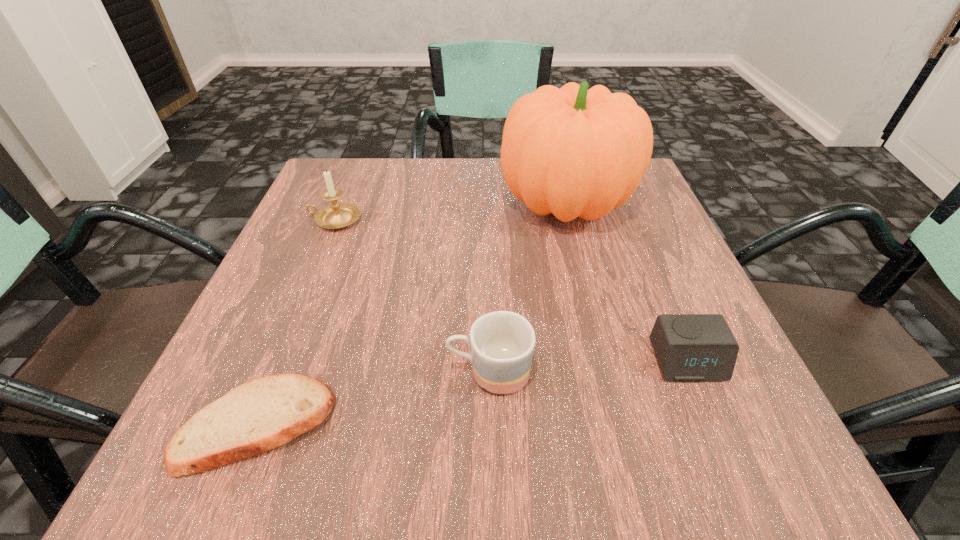
Identify the location of pumpkin. (573, 152).

Locate an element on the screen. The width and height of the screenshot is (960, 540). the second tallest object is located at coordinates (336, 215).

Where is `the third shortest object`? The image size is (960, 540). the third shortest object is located at coordinates (502, 343).

This screenshot has width=960, height=540. What are the coordinates of `the second shortest object` in the screenshot? It's located at (689, 347).

You are a GUI agent. You are given a task and a screenshot of the screen. Output one action in this format:
    pyautogui.click(x=<x>, y=<y>)
    Task: Click on the pita bread
    This screenshot has width=960, height=540.
    Given the screenshot: What is the action you would take?
    pyautogui.click(x=255, y=417)

You are a GUI agent. You are given a task and a screenshot of the screen. Output one action in this format:
    pyautogui.click(x=<x>, y=<y>)
    Task: Click on the vacant space located 0.060m on the back of the tallest object
    The height and width of the screenshot is (540, 960).
    Given the screenshot: What is the action you would take?
    pyautogui.click(x=554, y=157)

Locate an element on the screen. The height and width of the screenshot is (540, 960). vacant space situated on the side with the handle of the third tallest object is located at coordinates (222, 372).

Locate an element on the screen. The image size is (960, 540). free spot located 0.250m on the side with the handle of the third tallest object is located at coordinates (276, 372).

Locate an element on the screen. The height and width of the screenshot is (540, 960). free location located 0.280m on the side with the handle of the third tallest object is located at coordinates (256, 372).

Identify the location of vacant space located on the front-facing side of the alarm clock. (715, 428).